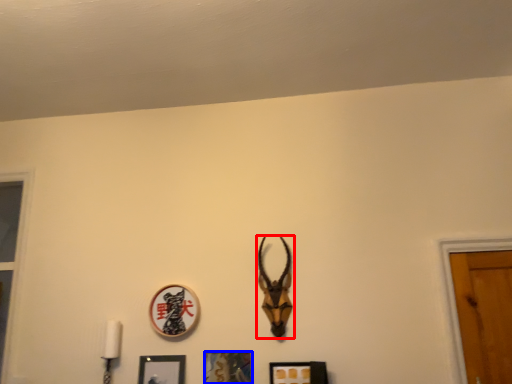
Question: Among these objects, which one is nearest to the camera, antelope (highlighted by a red box) or picture frame (highlighted by a blue box)?

Choices:
 (A) antelope
 (B) picture frame

Answer: (B)